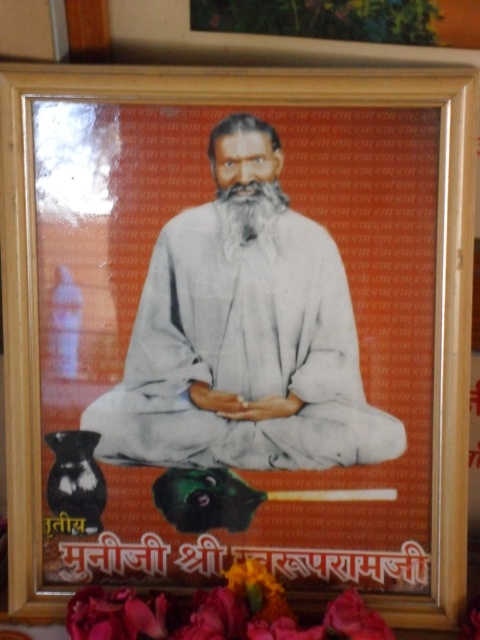
Question: Which point is closer to the camera?

Choices:
 (A) (207, 323)
 (B) (220, 224)

Answer: (B)

Question: Is silky pink petals at lower center thinner than white soft beard at center?

Choices:
 (A) no
 (B) yes

Answer: (A)

Question: Which point appears closest to the camera in this image?

Choices:
 (A) (231, 602)
 (B) (324, 257)
 (C) (273, 253)

Answer: (A)

Question: Does white cloth at center have a larger size compared to white soft beard at center?

Choices:
 (A) no
 (B) yes

Answer: (B)

Question: Which object is the farthest from the white cloth at center?

Choices:
 (A) white soft beard at center
 (B) silky pink petals at lower center

Answer: (B)

Question: Does silky pink petals at lower center have a smaller size compared to white soft beard at center?

Choices:
 (A) yes
 (B) no

Answer: (B)